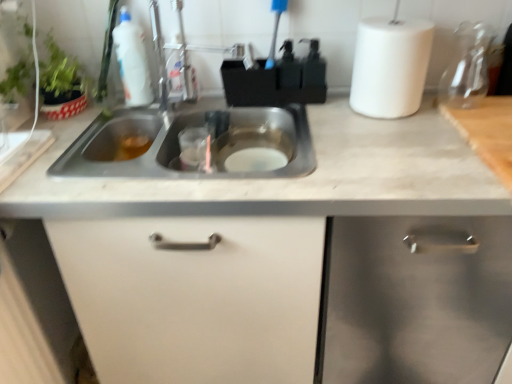
The image size is (512, 384). Identify the location of white matte paper towel at upper right. (390, 66).

What do you see at coordinates (179, 144) in the screenshot? I see `stainless steel sink at center` at bounding box center [179, 144].

You are a GUI agent. You are given a task and a screenshot of the screen. Output one action in this format:
    pyautogui.click(x=<x>, y=<y>)
    Task: Click on the white plastic bottle at upper left
    Image resolution: width=512 pixels, height=384 pixels.
    Given the screenshot: What is the action you would take?
    pyautogui.click(x=132, y=61)

Can you confirm if white matte cabinet at center, marked as the 2th cabinetry in a right-to-left arrangement, is taller than green leafy plant at upper left?

Yes, white matte cabinet at center, marked as the 2th cabinetry in a right-to-left arrangement, is taller than green leafy plant at upper left.

From the image's perspective, is white matte cabinet at center, placed as the 1th cabinetry when sorted from left to right, positioned above or below green leafy plant at upper left?

white matte cabinet at center, placed as the 1th cabinetry when sorted from left to right, is situated lower than green leafy plant at upper left in the image.

In the scene shown: Which object is further away from the camera, white matte cabinet at center, marked as the 2th cabinetry in a right-to-left arrangement, or green leafy plant at upper left?

green leafy plant at upper left is behind.

Is stainless steel sink at center situated inside green leafy plant at upper left or outside?

stainless steel sink at center is located beyond the bounds of green leafy plant at upper left.

Visually, is stainless steel sink at center positioned to the left or to the right of green leafy plant at upper left?

Clearly, stainless steel sink at center is on the right of green leafy plant at upper left in the image.

Between stainless steel sink at center and green leafy plant at upper left, which one has larger width?

stainless steel sink at center is wider.

In the scene shown: Does green leafy plant at upper left touch white matte paper towel at upper right?

There is a gap between green leafy plant at upper left and white matte paper towel at upper right.

Is white matte paper towel at upper right inside green leafy plant at upper left?

No, green leafy plant at upper left does not contain white matte paper towel at upper right.

From a real-world perspective, is green leafy plant at upper left positioned over white matte paper towel at upper right based on gravity?

No, from a real-world perspective, green leafy plant at upper left is not on top of white matte paper towel at upper right.

Consider the image. Considering the relative positions of green leafy plant at upper left and white matte paper towel at upper right in the image provided, is green leafy plant at upper left behind white matte paper towel at upper right?

No, the depth of green leafy plant at upper left is less than that of white matte paper towel at upper right.

How far apart are transparent glass carafe at upper right and white matte cabinet at center, marked as the 2th cabinetry in a right-to-left arrangement?

33.34 inches.

Based on the photo, from the image's perspective, is transparent glass carafe at upper right located beneath white matte cabinet at center, marked as the 2th cabinetry in a right-to-left arrangement?

No.

Is point (446, 93) farther from camera compared to point (278, 301)?

Yes, point (446, 93) is farther from viewer.

Who is taller, transparent glass carafe at upper right or white matte cabinet at center, placed as the 1th cabinetry when sorted from left to right?

white matte cabinet at center, placed as the 1th cabinetry when sorted from left to right, is taller.

Does stainless steel sink at center have a larger size compared to white matte cabinet at center, placed as the 1th cabinetry when sorted from left to right?

Actually, stainless steel sink at center might be smaller than white matte cabinet at center, placed as the 1th cabinetry when sorted from left to right.

Can you tell me how much stainless steel sink at center and white matte cabinet at center, marked as the 2th cabinetry in a right-to-left arrangement, differ in facing direction?

There is a 0.45-degree angle between the facing directions of stainless steel sink at center and white matte cabinet at center, marked as the 2th cabinetry in a right-to-left arrangement.

Considering the sizes of stainless steel sink at center and white matte cabinet at center, placed as the 1th cabinetry when sorted from left to right, in the image, is stainless steel sink at center taller or shorter than white matte cabinet at center, placed as the 1th cabinetry when sorted from left to right,?

In the image, stainless steel sink at center appears to be shorter than white matte cabinet at center, placed as the 1th cabinetry when sorted from left to right.

From the image's perspective, is stainless steel sink at center positioned above or below white matte cabinet at center, placed as the 1th cabinetry when sorted from left to right?

From the image's perspective, stainless steel sink at center appears above white matte cabinet at center, placed as the 1th cabinetry when sorted from left to right.

Does point (144, 69) appear closer or farther from the camera than point (456, 363)?

Point (144, 69) is closer to the camera than point (456, 363).

Which of these two, white plastic bottle at upper left or white matte cabinet at right, which is the 1th cabinetry in right-to-left order, is bigger?

With larger size is white matte cabinet at right, which is the 1th cabinetry in right-to-left order.

From a real-world perspective, does white plastic bottle at upper left stand above white matte cabinet at right, the 2th cabinetry in the left-to-right sequence?

Indeed, from a real-world perspective, white plastic bottle at upper left stands above white matte cabinet at right, the 2th cabinetry in the left-to-right sequence.

Who is taller, white plastic bottle at upper left or white matte cabinet at right, which is the 1th cabinetry in right-to-left order?

white matte cabinet at right, which is the 1th cabinetry in right-to-left order, is taller.

Is white matte cabinet at right, which is the 1th cabinetry in right-to-left order, located within white matte paper towel at upper right?

No, white matte cabinet at right, which is the 1th cabinetry in right-to-left order, is not surrounded by white matte paper towel at upper right.

From their relative heights in the image, would you say white matte paper towel at upper right is taller or shorter than white matte cabinet at right, the 2th cabinetry in the left-to-right sequence?

In the image, white matte paper towel at upper right appears to be shorter than white matte cabinet at right, the 2th cabinetry in the left-to-right sequence.

From a real-world perspective, is white matte paper towel at upper right over white matte cabinet at right, the 2th cabinetry in the left-to-right sequence?

Indeed, from a real-world perspective, white matte paper towel at upper right stands above white matte cabinet at right, the 2th cabinetry in the left-to-right sequence.

Which is more to the right, white matte paper towel at upper right or white matte cabinet at right, the 2th cabinetry in the left-to-right sequence?

From the viewer's perspective, white matte cabinet at right, the 2th cabinetry in the left-to-right sequence, appears more on the right side.

Locate an element on the screen. plant on the left of white matte cabinet at center, placed as the 1th cabinetry when sorted from left to right is located at coordinates (61, 74).

At what (x,y) coordinates should I click in order to perform the action: click on plant above the stainless steel sink at center (from the image's perspective). Please return your answer as a coordinate pair (x, y). The width and height of the screenshot is (512, 384). Looking at the image, I should click on (61, 74).

Which object lies further to the anchor point white matte cabinet at center, marked as the 2th cabinetry in a right-to-left arrangement, white plastic bottle at upper left or white matte cabinet at right, the 2th cabinetry in the left-to-right sequence?

The object further to white matte cabinet at center, marked as the 2th cabinetry in a right-to-left arrangement, is white matte cabinet at right, the 2th cabinetry in the left-to-right sequence.

Based on their spatial positions, is green leafy plant at upper left or white matte cabinet at center, marked as the 2th cabinetry in a right-to-left arrangement, further from stainless steel sink at center?

white matte cabinet at center, marked as the 2th cabinetry in a right-to-left arrangement.

Based on their spatial positions, is white matte cabinet at center, placed as the 1th cabinetry when sorted from left to right, or green leafy plant at upper left further from white matte paper towel at upper right?

green leafy plant at upper left.

From the picture: Based on their spatial positions, is white matte cabinet at center, marked as the 2th cabinetry in a right-to-left arrangement, or stainless steel sink at center further from white matte cabinet at right, which is the 1th cabinetry in right-to-left order?

stainless steel sink at center.

Considering their positions, is white matte paper towel at upper right positioned further to white matte cabinet at center, marked as the 2th cabinetry in a right-to-left arrangement, than green leafy plant at upper left?

The object further to white matte cabinet at center, marked as the 2th cabinetry in a right-to-left arrangement, is green leafy plant at upper left.

Looking at the image, which one is located further to white plastic bottle at upper left, white matte paper towel at upper right or transparent glass carafe at upper right?

transparent glass carafe at upper right is further to white plastic bottle at upper left.

Considering their positions, is transparent glass carafe at upper right positioned further to white matte paper towel at upper right than green leafy plant at upper left?

green leafy plant at upper left is further to white matte paper towel at upper right.

Which object lies nearer to the anchor point white plastic bottle at upper left, white matte cabinet at center, placed as the 1th cabinetry when sorted from left to right, or stainless steel sink at center?

The object closer to white plastic bottle at upper left is stainless steel sink at center.

The image size is (512, 384). Identify the location of cabinetry situated between white plastic bottle at upper left and white matte paper towel at upper right from left to right. (195, 296).

Find the location of a particular element. The image size is (512, 384). appliance between white matte paper towel at upper right and white matte cabinet at right, the 2th cabinetry in the left-to-right sequence, in the up-down direction is located at coordinates (467, 67).

This screenshot has width=512, height=384. I want to click on paper towel situated between white matte cabinet at center, placed as the 1th cabinetry when sorted from left to right, and transparent glass carafe at upper right from left to right, so click(390, 66).

Locate an element on the screen. sink between green leafy plant at upper left and white matte paper towel at upper right is located at coordinates (179, 144).